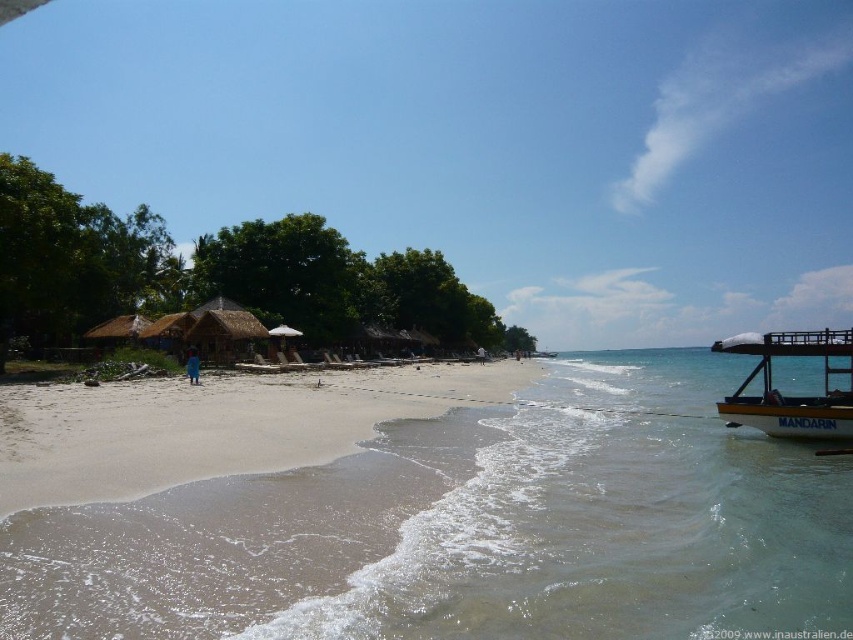
Is clear water at lower right thinner than yellow wooden boat at right?

No, clear water at lower right is not thinner than yellow wooden boat at right.

Which is in front, point (669, 368) or point (799, 416)?

Positioned in front is point (799, 416).

Which is in front, point (358, 474) or point (828, 346)?

Point (358, 474) is more forward.

The height and width of the screenshot is (640, 853). I want to click on clear water at lower right, so click(577, 518).

Can you confirm if sandy beach at lower left is positioned to the left of yellow wooden boat at right?

Correct, you'll find sandy beach at lower left to the left of yellow wooden boat at right.

Looking at this image, is sandy beach at lower left taller than yellow wooden boat at right?

No, sandy beach at lower left is not taller than yellow wooden boat at right.

What do you see at coordinates (235, 509) in the screenshot? The height and width of the screenshot is (640, 853). I see `sandy beach at lower left` at bounding box center [235, 509].

The height and width of the screenshot is (640, 853). What are the coordinates of `sandy beach at lower left` in the screenshot? It's located at (235, 509).

How distant is clear water at lower right from sandy beach at lower left?

clear water at lower right and sandy beach at lower left are 10.18 meters apart from each other.

Is clear water at lower right wider than sandy beach at lower left?

Correct, the width of clear water at lower right exceeds that of sandy beach at lower left.

Which is in front, point (703, 442) or point (289, 589)?

Positioned in front is point (289, 589).

Find the location of a particular element. clear water at lower right is located at coordinates (577, 518).